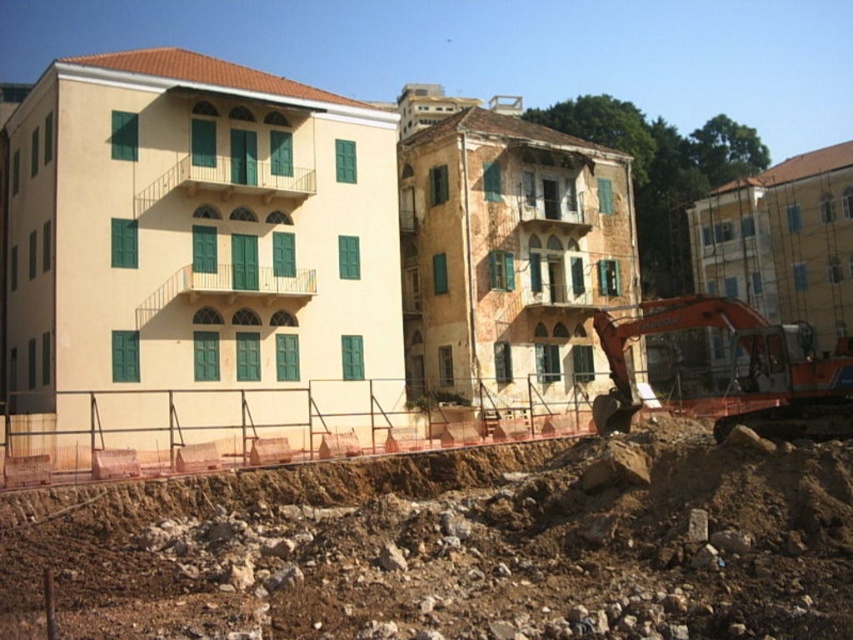
Which of these two, brown rocky dirt at lower center or orange metallic excavator at lower right, stands shorter?

brown rocky dirt at lower center is shorter.

I want to click on brown rocky dirt at lower center, so click(x=453, y=547).